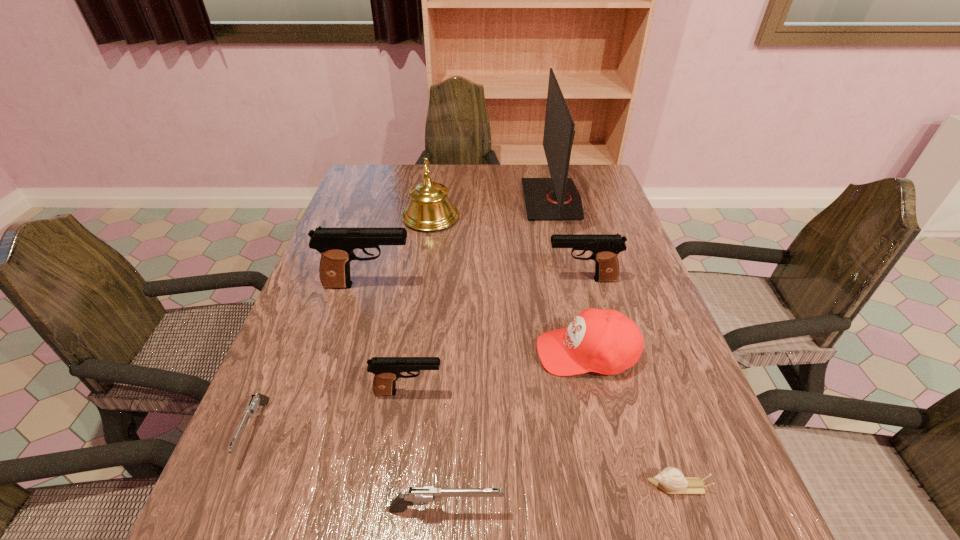
Where is `black monitor`? Image resolution: width=960 pixels, height=540 pixels. black monitor is located at coordinates (557, 198).

Image resolution: width=960 pixels, height=540 pixels. What are the coordinates of `the tallest object` in the screenshot? It's located at (557, 198).

At what (x,y) coordinates should I click in order to perform the action: click on bell. Please return your answer as a coordinate pair (x, y). The height and width of the screenshot is (540, 960). Looking at the image, I should click on (429, 209).

The height and width of the screenshot is (540, 960). In order to click on the tallest pistol in this screenshot , I will do `click(336, 245)`.

Locate an element on the screen. Image resolution: width=960 pixels, height=540 pixels. the fourth tallest object is located at coordinates (605, 247).

The width and height of the screenshot is (960, 540). Identify the location of the rightmost black pistol. point(605,247).

Where is `the sixth farthest object`? This screenshot has height=540, width=960. the sixth farthest object is located at coordinates (387, 370).

The image size is (960, 540). I want to click on the smallest black pistol, so click(387, 370).

This screenshot has height=540, width=960. I want to click on baseball cap, so click(x=607, y=342).

Find the location of a particular element. The width and height of the screenshot is (960, 540). the right silver pistol is located at coordinates (421, 495).